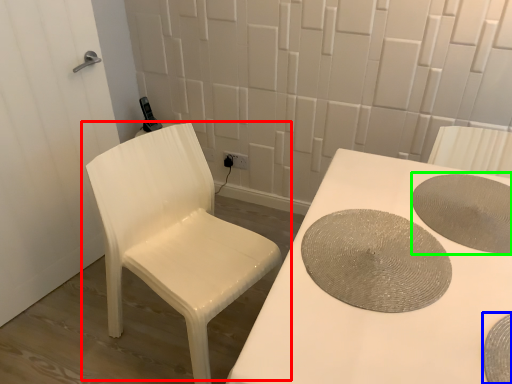
Question: Which object is the closest to the chair (highlighted by a red box)? Choose among these: manhole cover (highlighted by a blue box) or manhole cover (highlighted by a green box).

Choices:
 (A) manhole cover
 (B) manhole cover

Answer: (B)